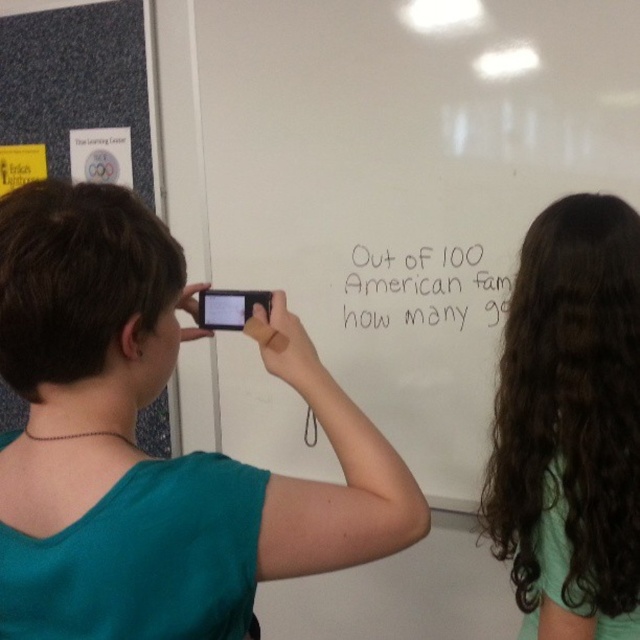
Question: From the image, what is the correct spatial relationship of teal fabric shirt at upper left in relation to black handwritten text at center?

Choices:
 (A) left
 (B) right

Answer: (A)

Question: Observing the image, what is the correct spatial positioning of blue fabric bulletin board at upper left in reference to teal fabric shirt at upper left?

Choices:
 (A) above
 (B) below

Answer: (A)

Question: Among these points, which one is nearest to the camera?

Choices:
 (A) (451, 262)
 (B) (532, 268)

Answer: (B)

Question: Is blue fabric bulletin board at upper left smaller than dark brown curly hair at upper right?

Choices:
 (A) no
 (B) yes

Answer: (A)

Question: Which object is the farthest from the blue fabric bulletin board at upper left?

Choices:
 (A) teal fabric shirt at upper left
 (B) dark brown curly hair at upper right

Answer: (A)

Question: Based on their relative distances, which object is nearer to the black handwritten text at center?

Choices:
 (A) blue fabric bulletin board at upper left
 (B) teal fabric shirt at upper left
 (C) dark brown curly hair at upper right
 (D) matte black smartphone at center

Answer: (A)